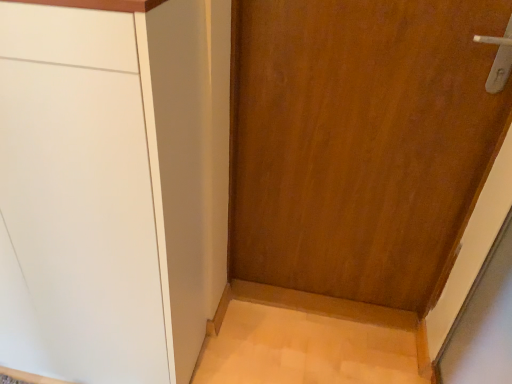
Locate an element on the screen. Image resolution: width=512 pixels, height=384 pixels. free area below wooden door at center (from a real-world perspective) is located at coordinates (335, 297).